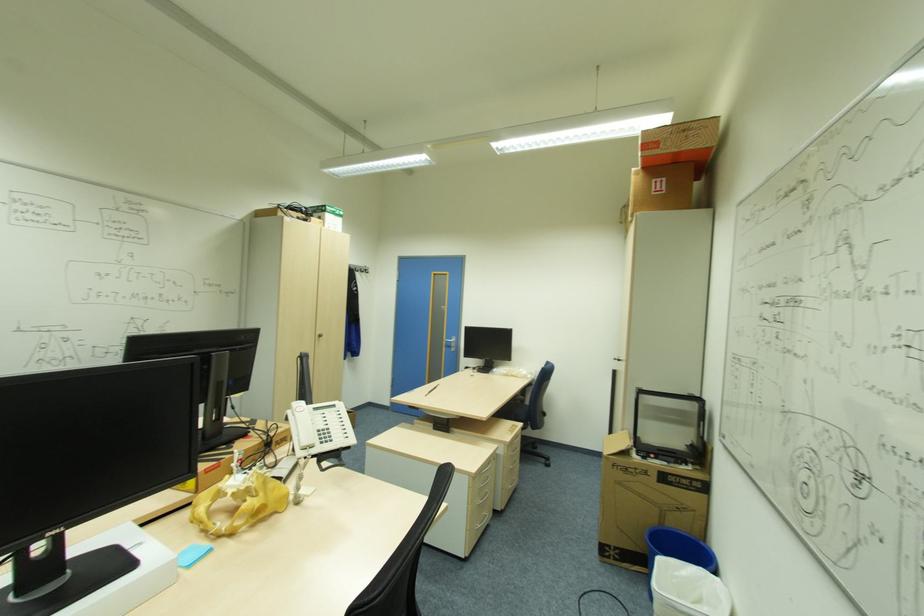
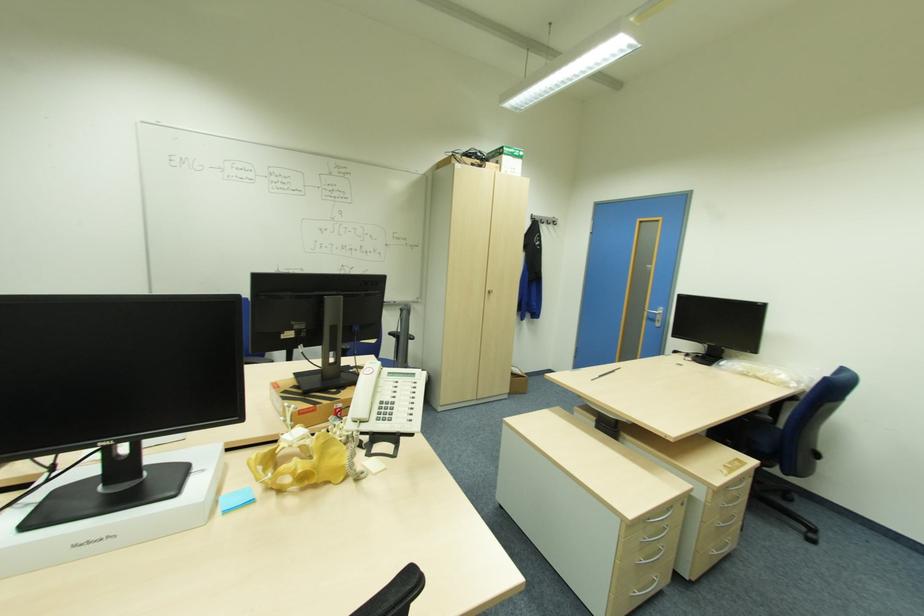
In the second image, find the point that corresponds to point (482, 525) in the first image.

(641, 594)